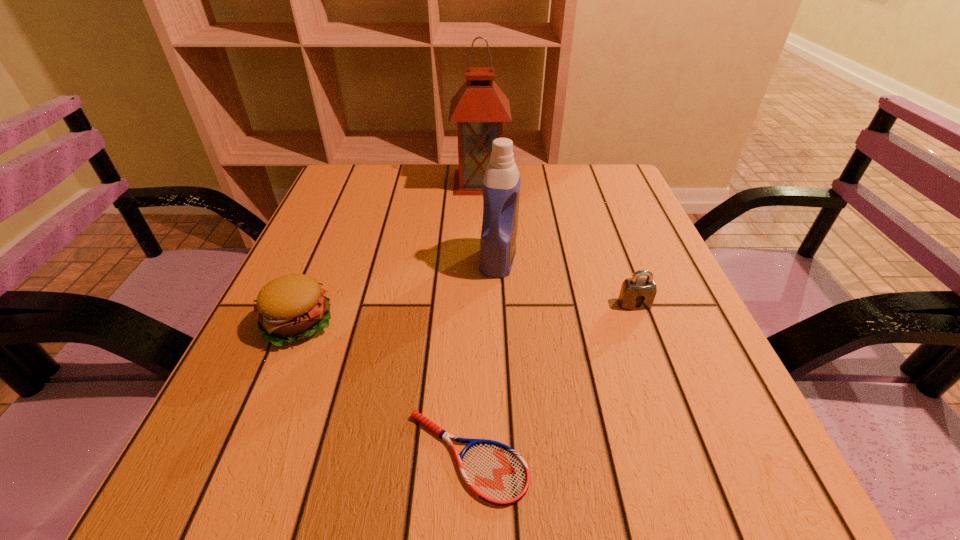
The width and height of the screenshot is (960, 540). I want to click on free point located on the back of the leftmost object, so click(336, 232).

Find the location of a particular element. vacant position located 0.210m at the front of the padlock near the keyhole is located at coordinates (x=674, y=410).

Identify the location of vacant area situated 0.270m on the back of the nearest object. Image resolution: width=960 pixels, height=540 pixels. (470, 290).

Where is `object that is at the far edge`? object that is at the far edge is located at coordinates (479, 107).

At what (x,y) coordinates should I click in order to perform the action: click on object that is positioned at the near edge. Please return your answer as a coordinate pair (x, y). The height and width of the screenshot is (540, 960). Looking at the image, I should click on (496, 473).

What are the coordinates of `object that is positioned at the left edge` in the screenshot? It's located at (292, 307).

At what (x,y) coordinates should I click in order to perform the action: click on object at the right edge. Please return your answer as a coordinate pair (x, y). The height and width of the screenshot is (540, 960). Looking at the image, I should click on (643, 290).

This screenshot has height=540, width=960. In the image, there is a desktop. Identify the location of vacant space at the far edge. (434, 182).

Find the location of a particular element. This screenshot has width=960, height=540. free spot at the near edge of the desktop is located at coordinates point(547,507).

Find the location of a particular element. The height and width of the screenshot is (540, 960). vacant region at the left edge of the desktop is located at coordinates (320, 393).